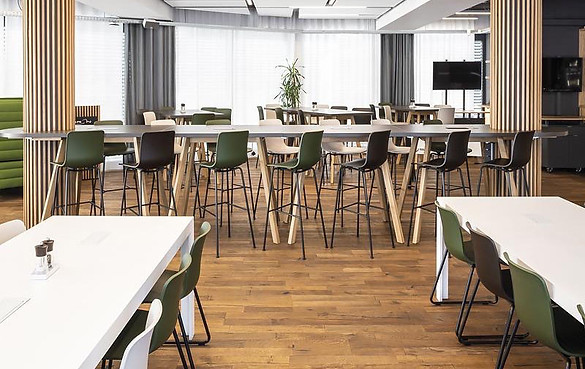
Find the location of a particular element. tables is located at coordinates (106, 258), (531, 251), (203, 128), (190, 111), (336, 110), (412, 108).